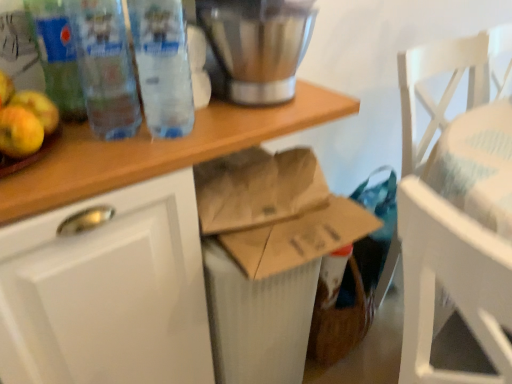
The image size is (512, 384). What are the coordinates of `free location in front of stainless steel blender at upper center` in the screenshot? It's located at (243, 122).